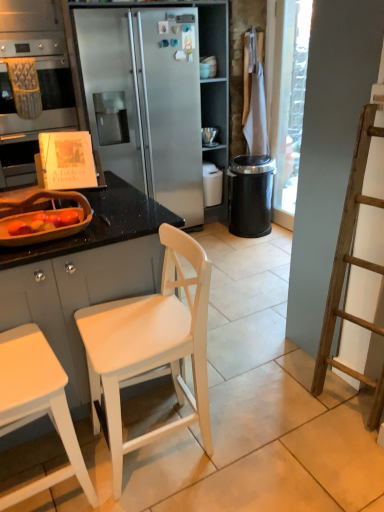
The width and height of the screenshot is (384, 512). Find the location of `free space on the front side of black plastic trash can at center-right`. free space on the front side of black plastic trash can at center-right is located at coordinates (273, 247).